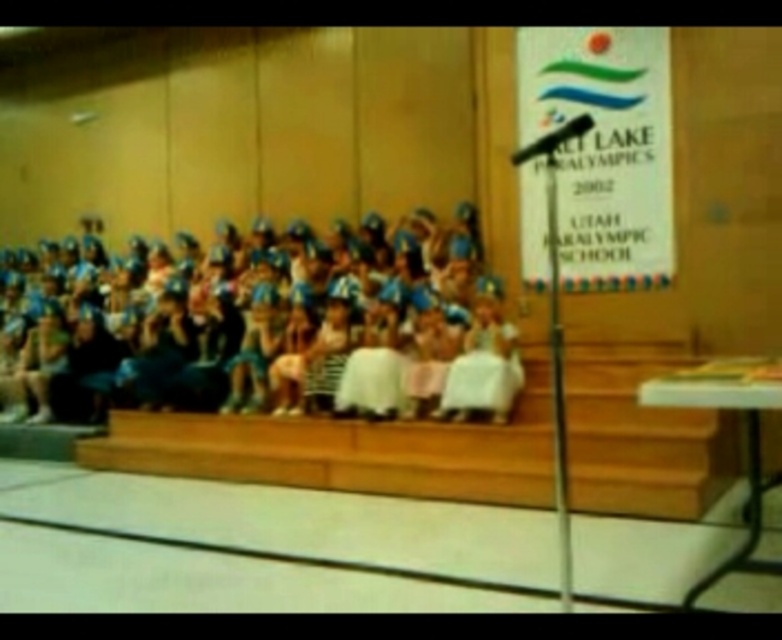
Question: Can you confirm if blue fabric dress at center is positioned to the left of wooden stairs at center?

Choices:
 (A) no
 (B) yes

Answer: (B)

Question: Which of the following is the farthest from the observer?

Choices:
 (A) blue fabric dress at center
 (B) wooden stairs at center

Answer: (A)

Question: In this image, where is blue fabric dress at center located relative to wooden stairs at center?

Choices:
 (A) left
 (B) right

Answer: (A)

Question: Which point appears closest to the camera in this image?

Choices:
 (A) (470, 490)
 (B) (91, 344)

Answer: (A)

Question: Is blue fabric dress at center to the right of wooden stairs at center from the viewer's perspective?

Choices:
 (A) yes
 (B) no

Answer: (B)

Question: Which of the following is the farthest from the observer?

Choices:
 (A) (421, 234)
 (B) (174, 428)

Answer: (A)